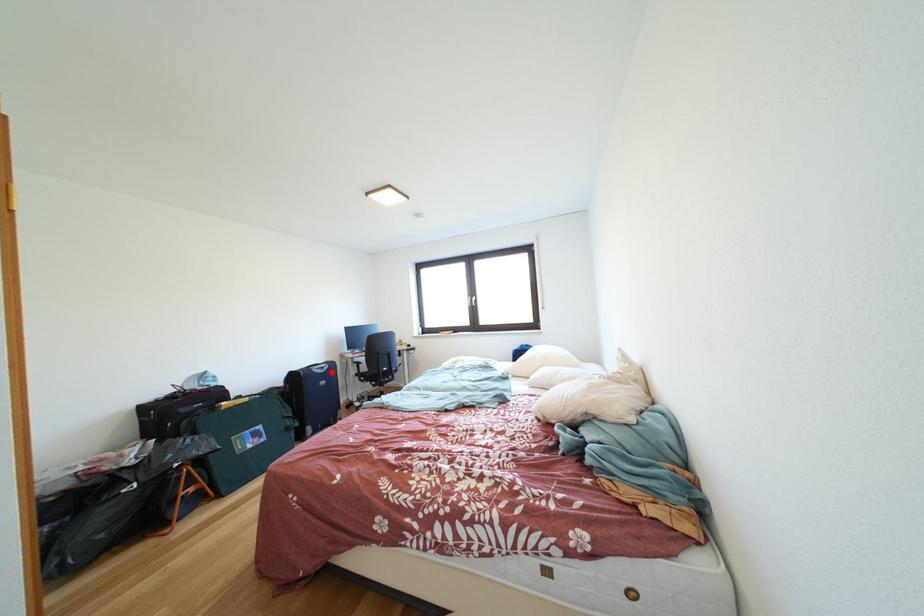
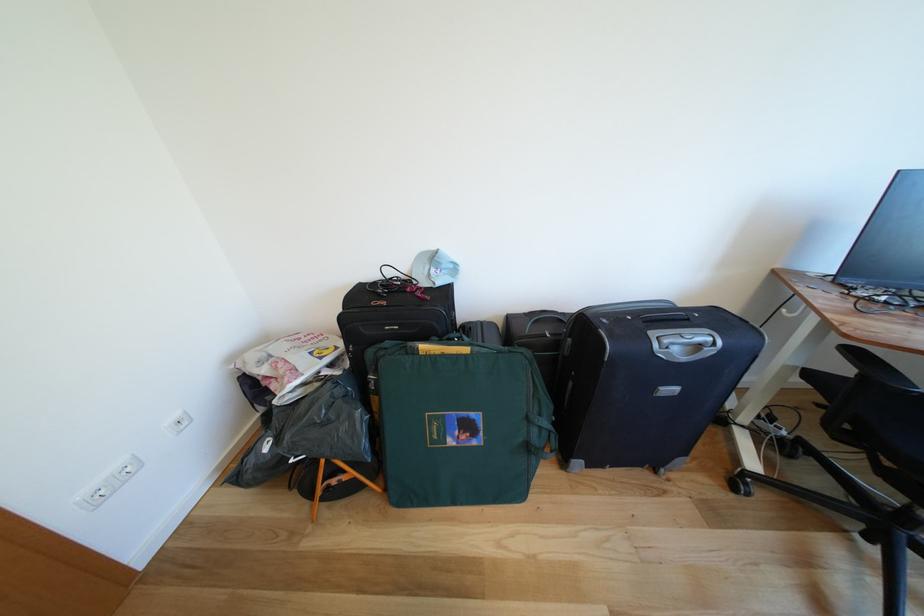
Where in the second image is the point corresponding to the highlighted location from the first image?

(707, 351)